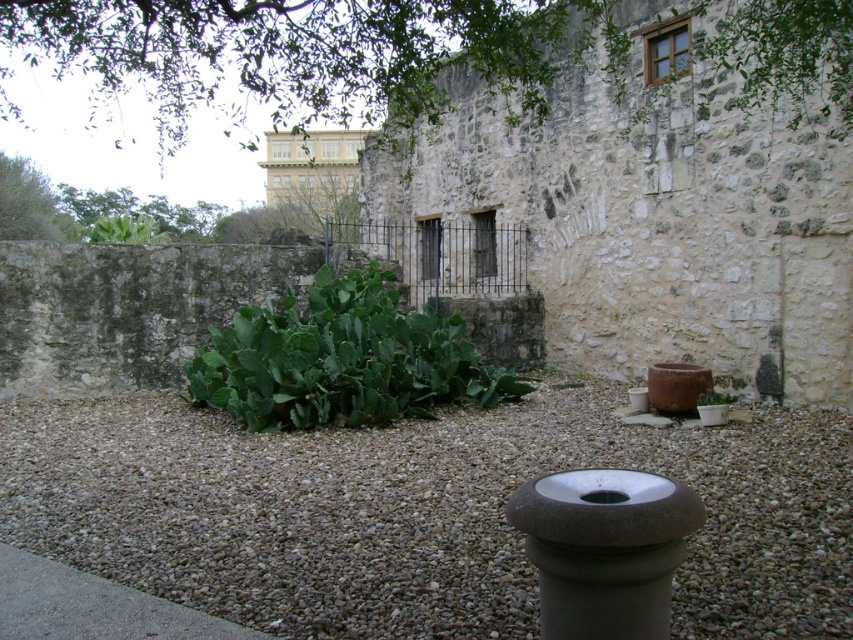
You are standing in front of the stone wall with the cactus and terracotta pots. There is a point marked at coordinates (x=421, y=512). What is located at this point?

The point at (x=421, y=512) indicates gray gravel at center.

You are a gardener trying to plant a new cactus. You have two spots available in the garden. One is near the gray gravel at center and the other is near the green leafy cactus at upper center. Which spot has more space for the new cactus?

The gray gravel at center is thinner than the green leafy cactus at upper center, so the spot near the gray gravel at center has more space for the new cactus.